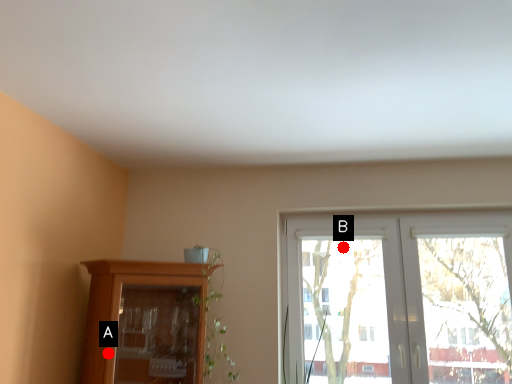
Question: Two points are circled on the image, labeled by A and B beside each circle. Among these points, which one is farthest from the camera?

Choices:
 (A) A is further
 (B) B is further

Answer: (B)